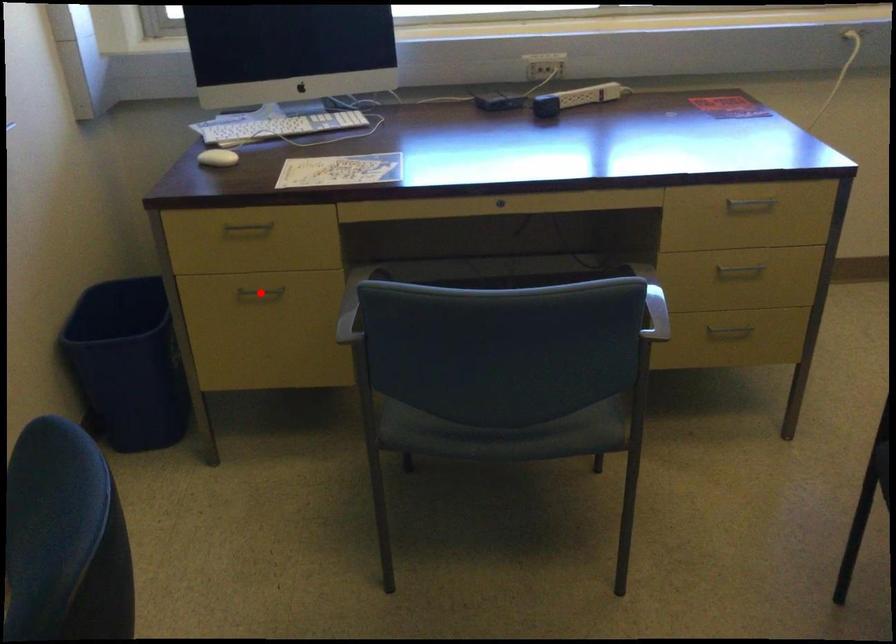
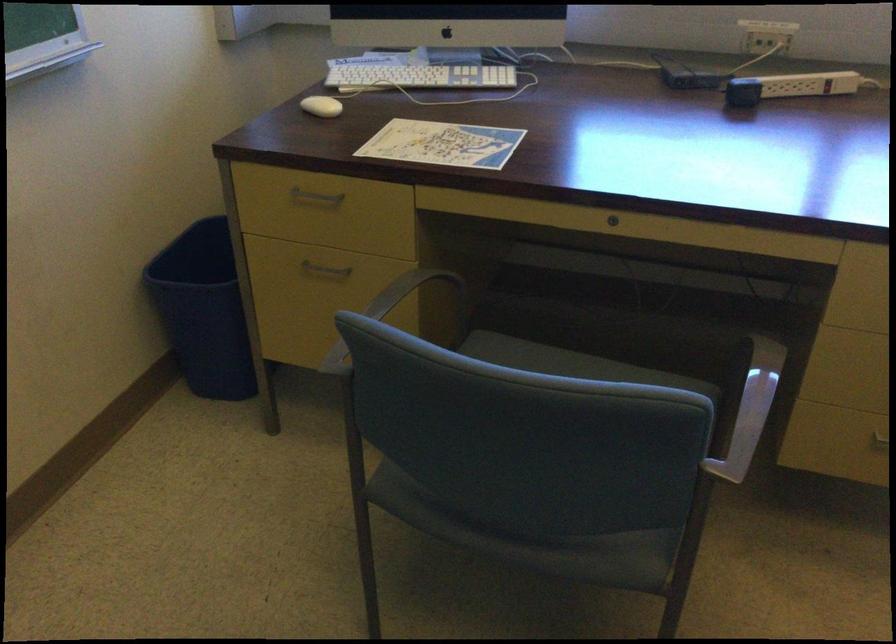
Question: I am providing you with two images of the same scene from different viewpoints. A red point is shown in image1. For the corresponding object point in image2, is it positioned nearer or farther from the camera?

Choices:
 (A) Nearer
 (B) Farther

Answer: (A)